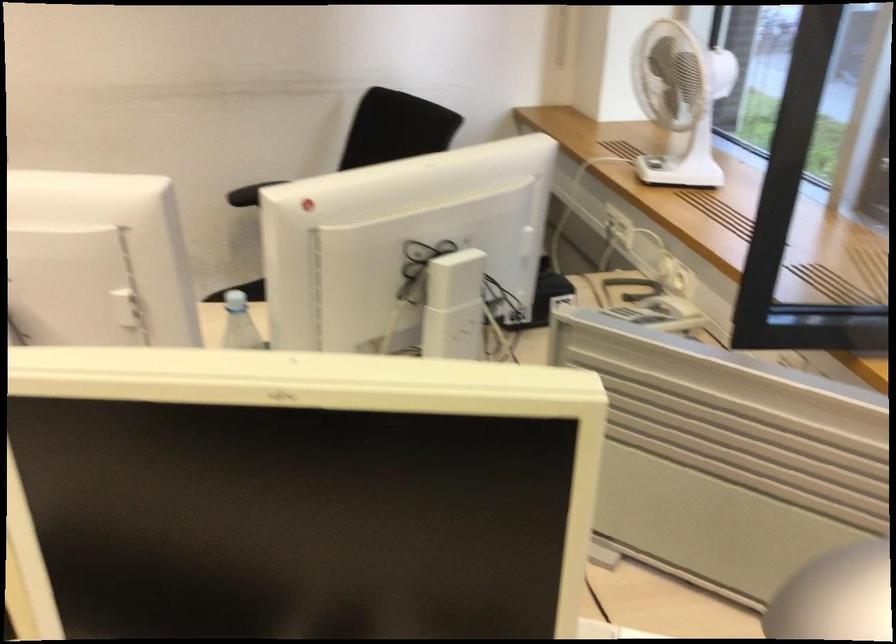
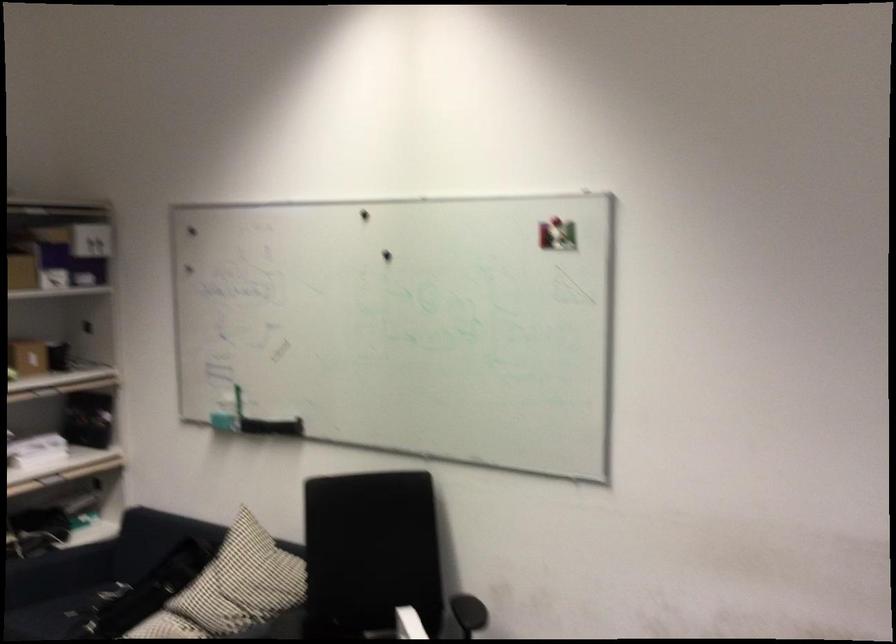
Question: How did the camera likely rotate?

Choices:
 (A) Left
 (B) Right
 (C) Up
 (D) Down

Answer: (A)